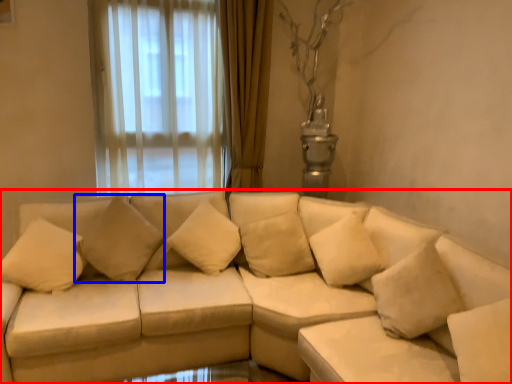
Question: Which object appears farthest to the camera in this image, studio couch (highlighted by a red box) or pillow (highlighted by a blue box)?

Choices:
 (A) studio couch
 (B) pillow

Answer: (B)